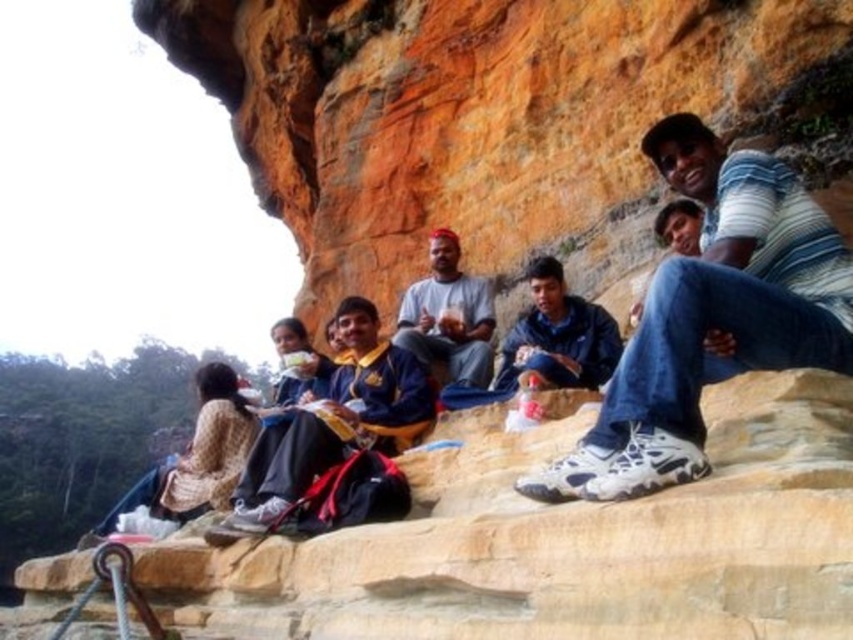
You are a photographer planning to take a group photo of the people on the rocky ledge. You need to ensure that the yellowish rock at center and the matte gray shirt at center are both visible in the frame. Considering their sizes, which object will require more space horizontally in the photo?

The yellowish rock at center requires more horizontal space because its width surpasses that of the matte gray shirt at center.

You are standing on the rocky ledge and want to take a photo of the group. To ensure both the blue jeans at center and the yellow fabric shirt at center are clearly visible, which one should you focus on first?

You should focus on the blue jeans at center first since it is in front of the yellow fabric shirt at center, ensuring both are in focus by starting with the closer object.

You are standing on the rocky ledge and want to hand a map to the person wearing the blue jeans at center. Which direction should you move relative to the yellow fabric shirt at center to reach them?

The blue jeans at center is to the right of the yellow fabric shirt at center, so you should move to the right of the yellow fabric shirt at center to reach the blue jeans at center.